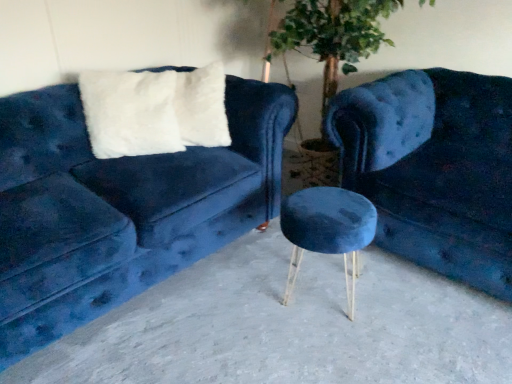
Question: Does velvet blue stool at center come in front of velvet blue couch at center, placed as the second studio couch when sorted from left to right?

Choices:
 (A) no
 (B) yes

Answer: (A)

Question: Does velvet blue stool at center turn towards velvet blue couch at center, placed as the second studio couch when sorted from left to right?

Choices:
 (A) no
 (B) yes

Answer: (A)

Question: Is velvet blue stool at center taller than velvet blue couch at center, the first studio couch viewed from the right?

Choices:
 (A) yes
 (B) no

Answer: (B)

Question: Is velvet blue stool at center not within velvet blue couch at center, placed as the second studio couch when sorted from left to right?

Choices:
 (A) yes
 (B) no

Answer: (A)

Question: Is velvet blue stool at center bigger than velvet blue couch at center, placed as the second studio couch when sorted from left to right?

Choices:
 (A) no
 (B) yes

Answer: (A)

Question: From a real-world perspective, is velvet blue stool at center positioned under velvet blue couch at center, the first studio couch viewed from the right, based on gravity?

Choices:
 (A) yes
 (B) no

Answer: (A)

Question: Could you tell me if smooth concrete stool at center is facing velvet blue couch at left, marked as the 2th studio couch in a right-to-left arrangement?

Choices:
 (A) yes
 (B) no

Answer: (B)

Question: Is velvet blue couch at left, which is counted as the 1th studio couch, starting from the left, at the back of smooth concrete stool at center?

Choices:
 (A) yes
 (B) no

Answer: (B)

Question: Does smooth concrete stool at center have a lesser height compared to velvet blue couch at left, marked as the 2th studio couch in a right-to-left arrangement?

Choices:
 (A) no
 (B) yes

Answer: (B)

Question: Is smooth concrete stool at center completely or partially outside of velvet blue couch at left, marked as the 2th studio couch in a right-to-left arrangement?

Choices:
 (A) no
 (B) yes

Answer: (B)

Question: Is smooth concrete stool at center positioned before velvet blue couch at left, which is counted as the 1th studio couch, starting from the left?

Choices:
 (A) yes
 (B) no

Answer: (A)

Question: Is smooth concrete stool at center to the right of velvet blue couch at left, marked as the 2th studio couch in a right-to-left arrangement, from the viewer's perspective?

Choices:
 (A) yes
 (B) no

Answer: (A)

Question: Can we say velvet blue couch at center, placed as the second studio couch when sorted from left to right, lies outside velvet blue stool at center?

Choices:
 (A) no
 (B) yes

Answer: (B)